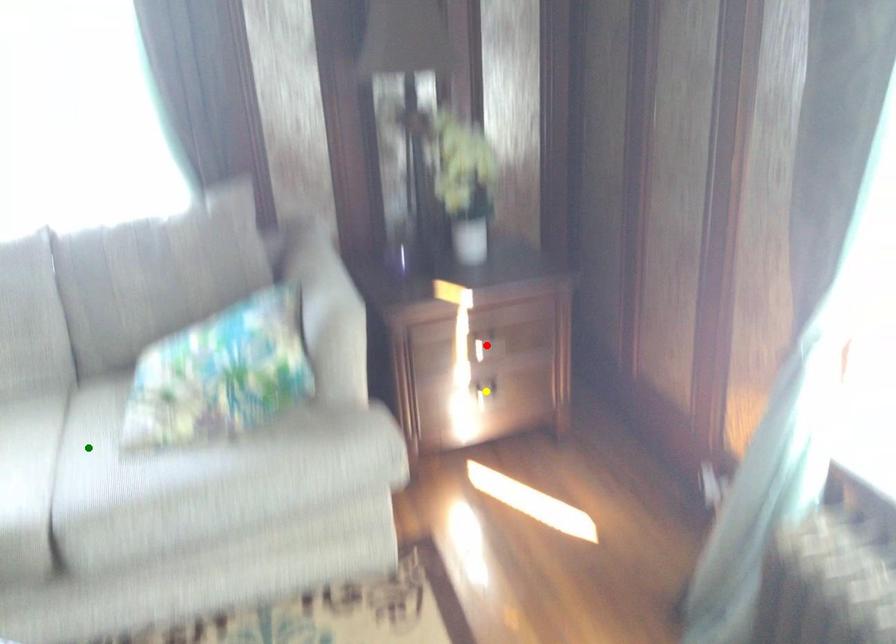
Order these from nearest to farthest:
- yellow point
- red point
- green point

green point
red point
yellow point